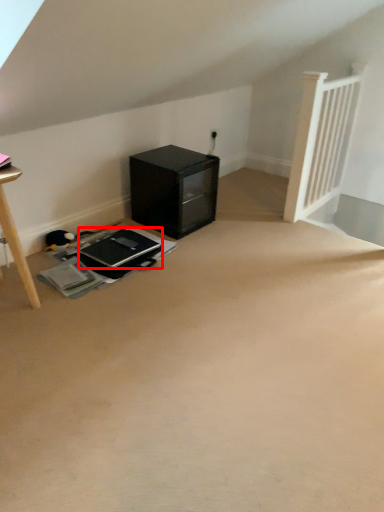
Question: In this image, where is laptop (annotated by the red box) located relative to furniture?

Choices:
 (A) left
 (B) right

Answer: (A)